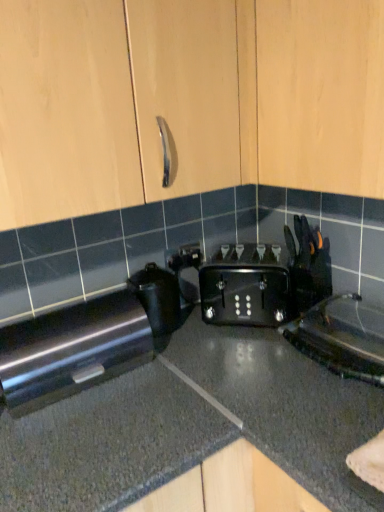
Describe the element at coordinates (338, 342) in the screenshot. I see `black plastic kettle at lower right, the 2th appliance in the left-to-right sequence` at that location.

The image size is (384, 512). What do you see at coordinates (321, 95) in the screenshot?
I see `light wood cabinet at upper center` at bounding box center [321, 95].

This screenshot has height=512, width=384. What do you see at coordinates (193, 424) in the screenshot?
I see `black granite countertop at center` at bounding box center [193, 424].

Where is `black plastic kettle at lower right, the first appliance positioned from the right`? The height and width of the screenshot is (512, 384). black plastic kettle at lower right, the first appliance positioned from the right is located at coordinates (338, 342).

Which is behind, point (142, 292) or point (312, 66)?

The point (142, 292) is farther.

Between black plastic toaster at center, which ranks as the 2th appliance in right-to-left order, and light wood cabinet at upper center, which one has less height?

black plastic toaster at center, which ranks as the 2th appliance in right-to-left order, is shorter.

From a real-world perspective, is black plastic toaster at center, which ranks as the 2th appliance in right-to-left order, beneath light wood cabinet at upper center?

Indeed, from a real-world perspective, black plastic toaster at center, which ranks as the 2th appliance in right-to-left order, is positioned beneath light wood cabinet at upper center.

Is black plastic toaster at center, which ranks as the 2th appliance in right-to-left order, beside light wood cabinet at upper center?

No, black plastic toaster at center, which ranks as the 2th appliance in right-to-left order, is not making contact with light wood cabinet at upper center.

From a real-world perspective, between black plastic kettle at lower right, the first appliance positioned from the right, and satin black toaster at lower left, who is vertically lower?

From a 3D spatial view, black plastic kettle at lower right, the first appliance positioned from the right, is below.

Considering the positions of objects black plastic kettle at lower right, the first appliance positioned from the right, and satin black toaster at lower left in the image provided, who is more to the right, black plastic kettle at lower right, the first appliance positioned from the right, or satin black toaster at lower left?

black plastic kettle at lower right, the first appliance positioned from the right, is more to the right.

Who is smaller, black plastic kettle at lower right, the first appliance positioned from the right, or satin black toaster at lower left?

With smaller size is black plastic kettle at lower right, the first appliance positioned from the right.

Considering their positions, is black plastic kettle at lower right, the first appliance positioned from the right, located in front of or behind satin black toaster at lower left?

black plastic kettle at lower right, the first appliance positioned from the right, is positioned closer to the viewer than satin black toaster at lower left.

Looking at their sizes, would you say satin black toaster at lower left is wider or thinner than black plastic kettle at lower right, the first appliance positioned from the right?

Considering their sizes, satin black toaster at lower left looks slimmer than black plastic kettle at lower right, the first appliance positioned from the right.

The height and width of the screenshot is (512, 384). In order to click on appliance that is the 1st one when counting upward from the satin black toaster at lower left (from the image's perspective) in this screenshot , I will do `click(338, 342)`.

Considering the sizes of objects satin black toaster at lower left and black plastic kettle at lower right, the 2th appliance in the left-to-right sequence, in the image provided, who is smaller, satin black toaster at lower left or black plastic kettle at lower right, the 2th appliance in the left-to-right sequence,?

Smaller between the two is black plastic kettle at lower right, the 2th appliance in the left-to-right sequence.

Is point (97, 325) closer or farther from the camera than point (334, 298)?

Point (97, 325) appears to be closer to the viewer than point (334, 298).

Can you tell me how much black granite countertop at center and black plastic toaster at center, which ranks as the 2th appliance in right-to-left order, differ in facing direction?

90.6 degrees separate the facing orientations of black granite countertop at center and black plastic toaster at center, which ranks as the 2th appliance in right-to-left order.

Is point (141, 450) positioned after point (165, 293)?

No, (141, 450) is in front of (165, 293).

Can you see black granite countertop at center touching black plastic toaster at center, which ranks as the 2th appliance in right-to-left order?

There is a gap between black granite countertop at center and black plastic toaster at center, which ranks as the 2th appliance in right-to-left order.

Is black granite countertop at center to the left of black plastic toaster at center, which ranks as the first appliance in left-to-right order, from the viewer's perspective?

In fact, black granite countertop at center is to the right of black plastic toaster at center, which ranks as the first appliance in left-to-right order.

In the image, there is a light wood cabinet at upper center. Where is `home appliance below it (from the image's perspective)`? The height and width of the screenshot is (512, 384). home appliance below it (from the image's perspective) is located at coordinates (87, 341).

Who is shorter, satin black toaster at lower left or light wood cabinet at upper center?

Standing shorter between the two is satin black toaster at lower left.

Which point is more distant from viewer, (47, 321) or (320, 39)?

Point (47, 321)

Based on the photo, would you say black granite countertop at center is outside light wood cabinet at upper center?

Yes, black granite countertop at center is located beyond the bounds of light wood cabinet at upper center.

Based on the photo, is black granite countertop at center oriented away from light wood cabinet at upper center?

No, black granite countertop at center is not facing the opposite direction of light wood cabinet at upper center.

Can you confirm if black granite countertop at center is shorter than light wood cabinet at upper center?

No, black granite countertop at center is not shorter than light wood cabinet at upper center.

Which is more to the left, satin black toaster at lower left or black plastic toaster at center, which ranks as the 2th appliance in right-to-left order?

satin black toaster at lower left.

Which object is thinner, satin black toaster at lower left or black plastic toaster at center, which ranks as the first appliance in left-to-right order?

black plastic toaster at center, which ranks as the first appliance in left-to-right order.

Can you tell me how much satin black toaster at lower left and black plastic toaster at center, which ranks as the first appliance in left-to-right order, differ in facing direction?

0.000447 degrees separate the facing orientations of satin black toaster at lower left and black plastic toaster at center, which ranks as the first appliance in left-to-right order.

Considering the relative positions of satin black toaster at lower left and black plastic toaster at center, which ranks as the 2th appliance in right-to-left order, in the image provided, is satin black toaster at lower left in front of black plastic toaster at center, which ranks as the 2th appliance in right-to-left order,?

Yes, satin black toaster at lower left is in front of black plastic toaster at center, which ranks as the 2th appliance in right-to-left order.

The image size is (384, 512). Find the location of `appliance that is the 2nd one when counting backward from the light wood cabinet at upper center`. appliance that is the 2nd one when counting backward from the light wood cabinet at upper center is located at coordinates (158, 297).

At what (x,y) coordinates should I click in order to perform the action: click on home appliance on the left of black plastic kettle at lower right, the 2th appliance in the left-to-right sequence. Please return your answer as a coordinate pair (x, y). Image resolution: width=384 pixels, height=512 pixels. Looking at the image, I should click on (87, 341).

From the image, which object appears to be nearer to black plastic toaster at center, which ranks as the first appliance in left-to-right order, black granite countertop at center or light wood cabinet at upper center?

Among the two, black granite countertop at center is located nearer to black plastic toaster at center, which ranks as the first appliance in left-to-right order.

Based on the photo, looking at the image, which one is located further to black plastic toaster at center, which ranks as the first appliance in left-to-right order, satin black toaster at lower left or light wood cabinet at upper center?

Based on the image, light wood cabinet at upper center appears to be further to black plastic toaster at center, which ranks as the first appliance in left-to-right order.

Looking at the image, which one is located closer to light wood cabinet at upper center, black plastic kettle at lower right, the first appliance positioned from the right, or black granite countertop at center?

black plastic kettle at lower right, the first appliance positioned from the right.

Based on their spatial positions, is satin black toaster at lower left or black granite countertop at center closer to black plastic toaster at center, which ranks as the first appliance in left-to-right order?

The object closer to black plastic toaster at center, which ranks as the first appliance in left-to-right order, is satin black toaster at lower left.

From the image, which object appears to be farther from black plastic toaster at center, which ranks as the first appliance in left-to-right order, black granite countertop at center or satin black toaster at lower left?

The object further to black plastic toaster at center, which ranks as the first appliance in left-to-right order, is black granite countertop at center.

From the image, which object appears to be nearer to light wood cabinet at upper center, black plastic toaster at center, which ranks as the first appliance in left-to-right order, or black granite countertop at center?

black plastic toaster at center, which ranks as the first appliance in left-to-right order.

Considering their positions, is satin black toaster at lower left positioned closer to black plastic kettle at lower right, the 2th appliance in the left-to-right sequence, than black granite countertop at center?

black granite countertop at center lies closer to black plastic kettle at lower right, the 2th appliance in the left-to-right sequence, than the other object.

In the scene shown: Looking at the image, which one is located further to light wood cabinet at upper center, black granite countertop at center or black plastic kettle at lower right, the 2th appliance in the left-to-right sequence?

Based on the image, black granite countertop at center appears to be further to light wood cabinet at upper center.

Image resolution: width=384 pixels, height=512 pixels. Identify the location of appliance that lies between light wood cabinet at upper center and black plastic kettle at lower right, the first appliance positioned from the right, from top to bottom. [158, 297].

I want to click on cabinetry between satin black toaster at lower left and black plastic kettle at lower right, the first appliance positioned from the right, in the horizontal direction, so click(321, 95).

You are a GUI agent. You are given a task and a screenshot of the screen. Output one action in this format:
    pyautogui.click(x=<x>, y=<y>)
    Task: Click on the appliance located between satin black toaster at lower left and light wood cabinet at upper center in the left-right direction
    This screenshot has height=512, width=384.
    Given the screenshot: What is the action you would take?
    pyautogui.click(x=158, y=297)

The height and width of the screenshot is (512, 384). Identify the location of home appliance between light wood cabinet at upper center and black granite countertop at center in the vertical direction. (87, 341).